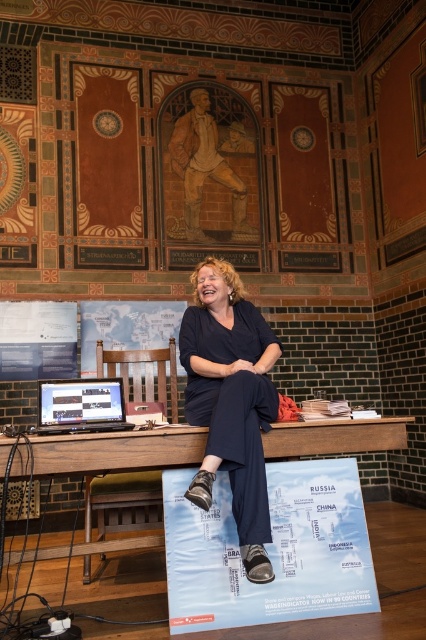
You are a photographer setting up a shoot in the room described. You need to ensure that the dark blue fabric pants at center and the matte black laptop at center are both visible in the frame. Based on their current positions, is there a risk that one might block the other in the photo?

The dark blue fabric pants at center is positioned over the matte black laptop at center, so the pants would block the laptop in the photo.

You are a photographer setting up a shot of the woman sitting on the wooden desk. The dark blue fabric pants at center and the matte black laptop at center are both in the frame. You need to ensure there is at least 20 inches between them for proper composition. Based on the scene, can you confirm if the current distance meets your requirement?

The dark blue fabric pants at center is 18.48 inches away from the matte black laptop at center. Since 18.48 inches is less than 20 inches, the current distance does not meet the requirement for proper composition.